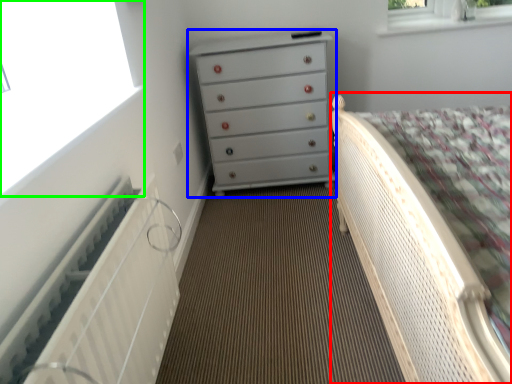
Question: Estimate the real-world distances between objects in this image. Which object is farther from bed (highlighted by a red box), chest of drawers (highlighted by a blue box) or window (highlighted by a green box)?

Choices:
 (A) chest of drawers
 (B) window

Answer: (A)